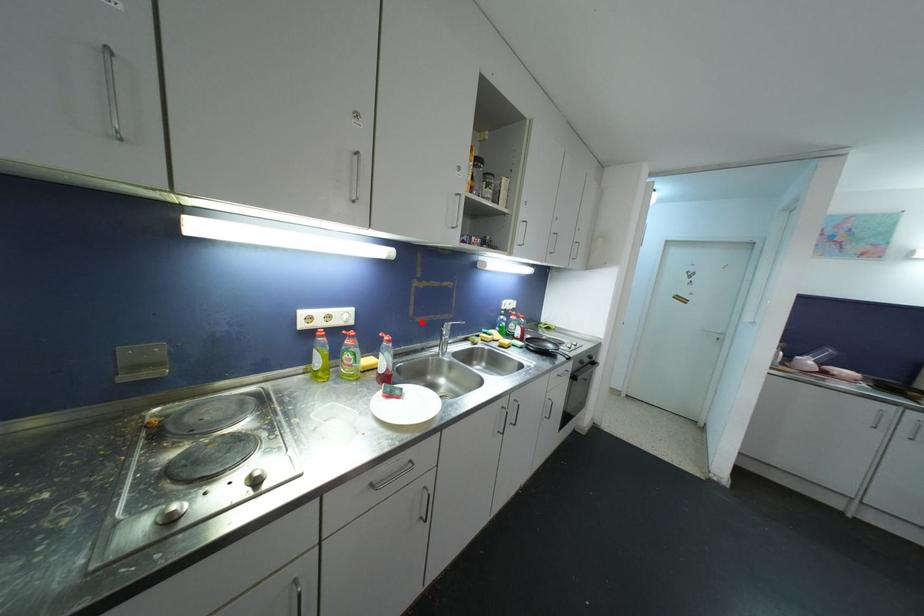
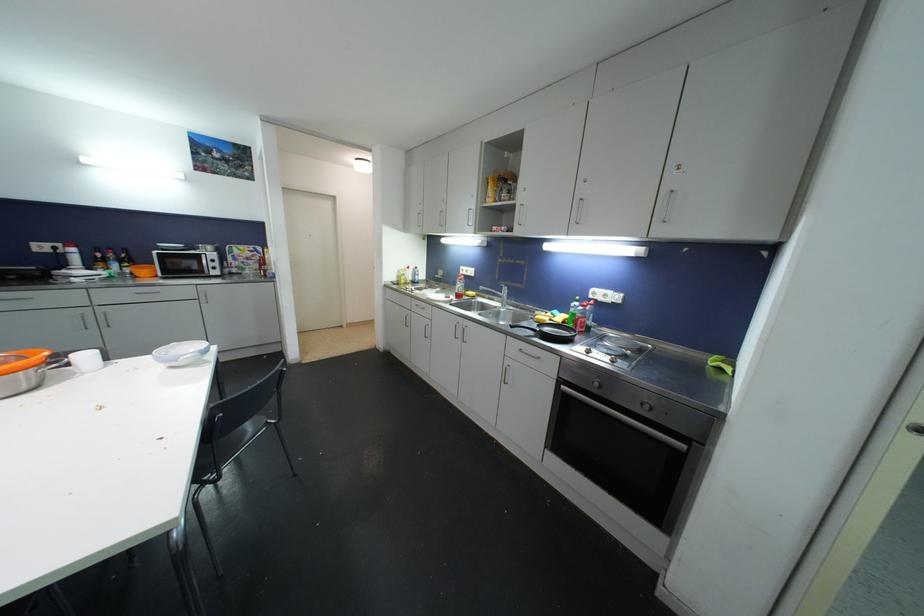
Where in the second image is the point corresponding to the highlighted location from the first image?

(504, 285)